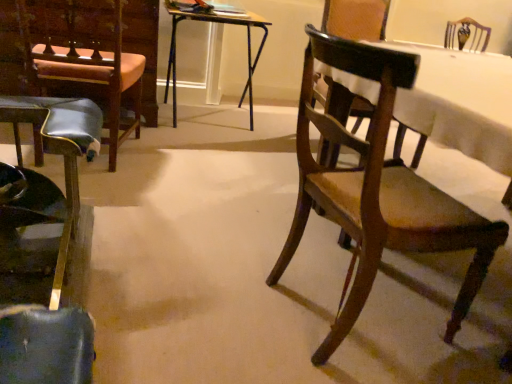
Question: Is shiny black stool at left, the 1th chair when ordered from left to right, next to wooden folding table at center and touching it?

Choices:
 (A) yes
 (B) no

Answer: (B)

Question: Does shiny black stool at left, the 1th chair when ordered from left to right, come behind wooden folding table at center?

Choices:
 (A) yes
 (B) no

Answer: (B)

Question: Is shiny black stool at left, the 1th chair when ordered from left to right, looking in the opposite direction of wooden folding table at center?

Choices:
 (A) yes
 (B) no

Answer: (B)

Question: Is the position of shiny black stool at left, the 1th chair when ordered from left to right, less distant than that of wooden folding table at center?

Choices:
 (A) yes
 (B) no

Answer: (A)

Question: Considering the relative sizes of shiny black stool at left, the 1th chair when ordered from left to right, and wooden folding table at center in the image provided, is shiny black stool at left, the 1th chair when ordered from left to right, bigger than wooden folding table at center?

Choices:
 (A) yes
 (B) no

Answer: (B)

Question: Considering the relative positions of shiny black stool at left, placed as the 2th chair when sorted from right to left, and wooden folding table at center in the image provided, is shiny black stool at left, placed as the 2th chair when sorted from right to left, to the left of wooden folding table at center from the viewer's perspective?

Choices:
 (A) no
 (B) yes

Answer: (B)

Question: From the image's perspective, is leather seat at left, the first armchair positioned from the left, on top of wooden folding table at center?

Choices:
 (A) yes
 (B) no

Answer: (B)

Question: Is leather seat at left, the first armchair positioned from the left, positioned far away from wooden folding table at center?

Choices:
 (A) no
 (B) yes

Answer: (A)

Question: Does leather seat at left, the first armchair positioned from the left, lie in front of wooden folding table at center?

Choices:
 (A) no
 (B) yes

Answer: (B)

Question: From a real-world perspective, does leather seat at left, the first armchair positioned from the left, stand above wooden folding table at center?

Choices:
 (A) yes
 (B) no

Answer: (A)

Question: Is leather seat at left, the first armchair positioned from the left, aimed at wooden folding table at center?

Choices:
 (A) yes
 (B) no

Answer: (B)

Question: Considering the relative sizes of leather seat at left, the second armchair viewed from the right, and wooden folding table at center in the image provided, is leather seat at left, the second armchair viewed from the right, wider than wooden folding table at center?

Choices:
 (A) no
 (B) yes

Answer: (A)

Question: Is wooden folding table at center at the back of wooden chair at right, the 1th armchair from the right?

Choices:
 (A) yes
 (B) no

Answer: (B)